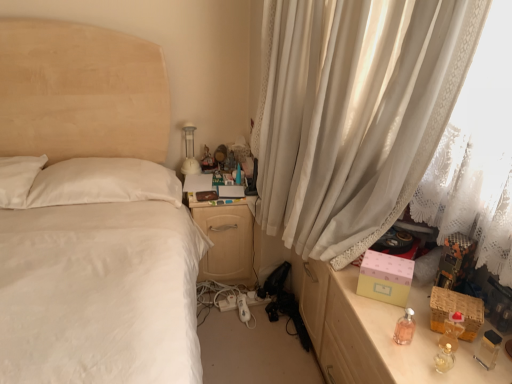
This screenshot has width=512, height=384. Find the location of `vacant space in front of pink glass perfume at lower right, the first perfume in the left-to-right sequence`. vacant space in front of pink glass perfume at lower right, the first perfume in the left-to-right sequence is located at coordinates (407, 362).